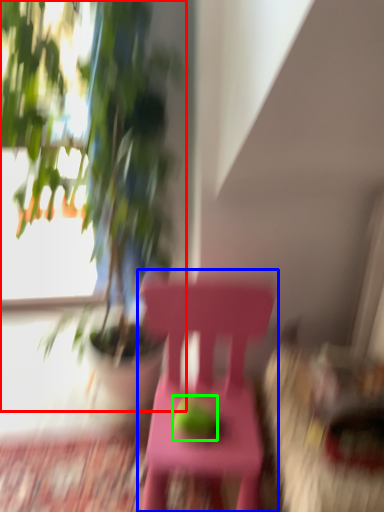
Question: Which object is the farthest from houseplant (highlighted by a red box)? Choose among these: chair (highlighted by a blue box) or fruit (highlighted by a green box).

Choices:
 (A) chair
 (B) fruit

Answer: (B)